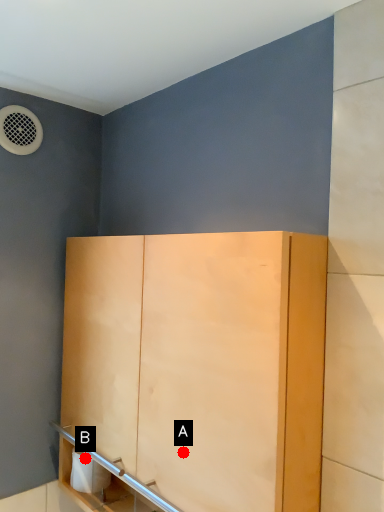
Question: Two points are circled on the image, labeled by A and B beside each circle. Which point appears farthest from the camera in this image?

Choices:
 (A) A is further
 (B) B is further

Answer: (B)